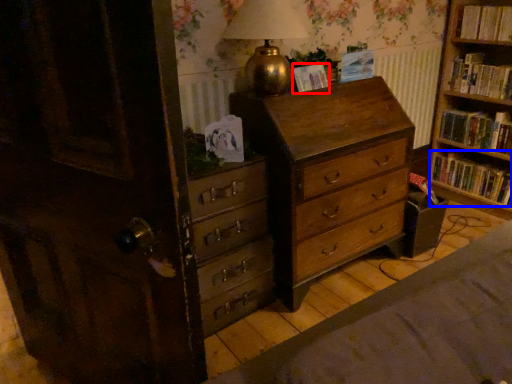
Question: Which object appears closest to the camera in this image, paperback book (highlighted by a red box) or book (highlighted by a blue box)?

Choices:
 (A) paperback book
 (B) book

Answer: (A)